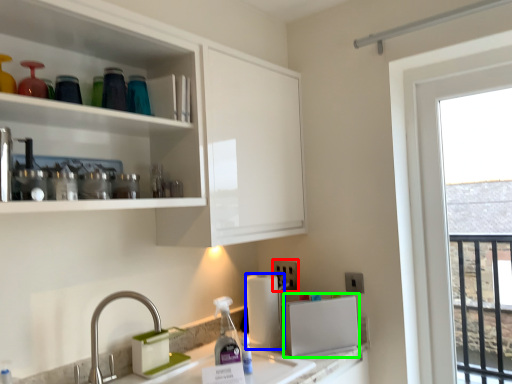
Question: Estimate the real-world distances between objects in this image. Which object is closer to electric outlet (highlighted by a red box), paper towel (highlighted by a blue box) or appliance (highlighted by a green box)?

Choices:
 (A) paper towel
 (B) appliance

Answer: (A)